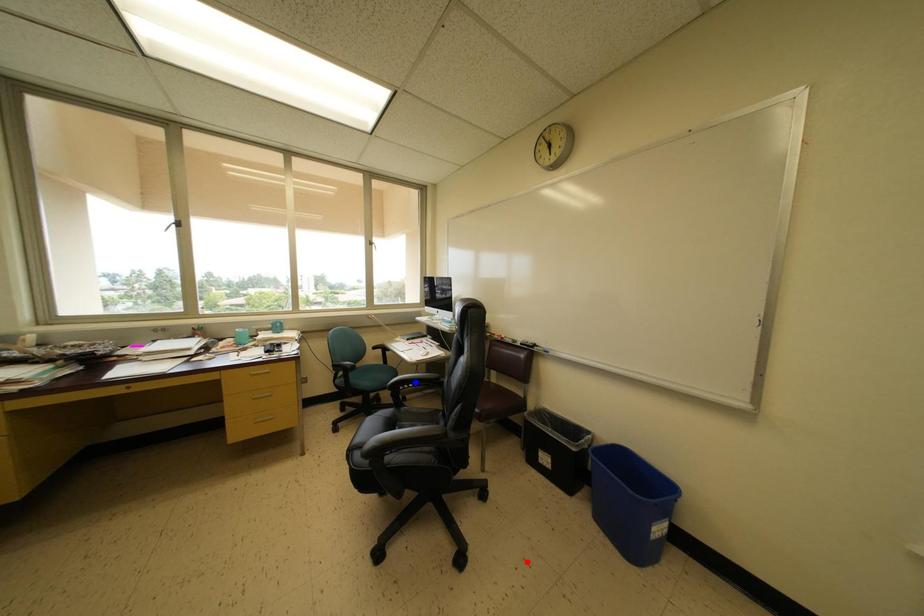
Question: Which of the two points in the image is closer to the camera?

Choices:
 (A) Blue point is closer.
 (B) Red point is closer.

Answer: (B)